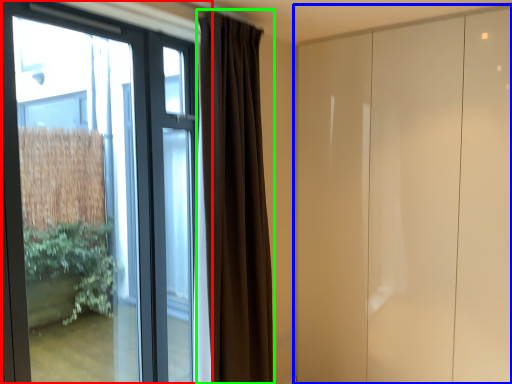
Question: Which is nearer to the window (highlighted by a red box)? door (highlighted by a blue box) or curtain (highlighted by a green box).

Choices:
 (A) door
 (B) curtain

Answer: (B)